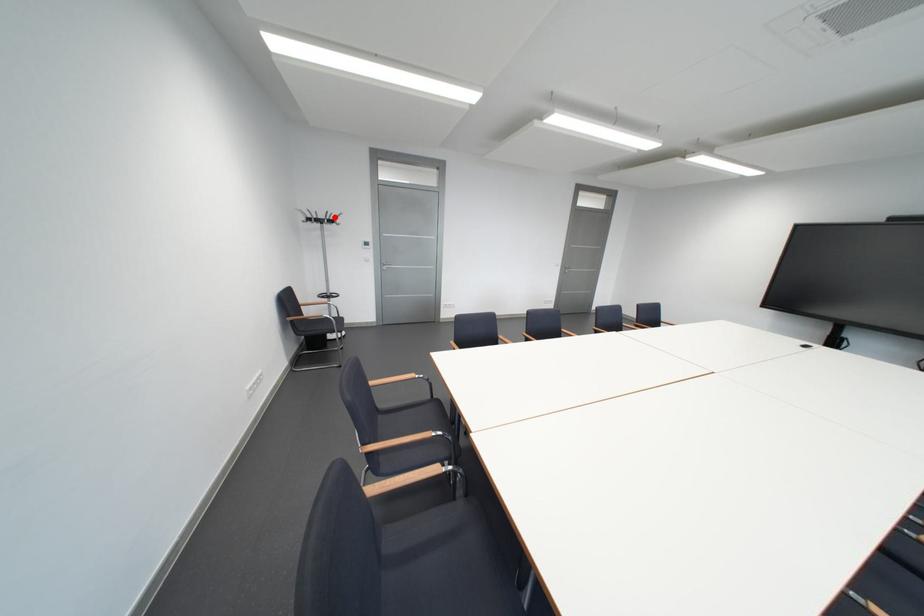
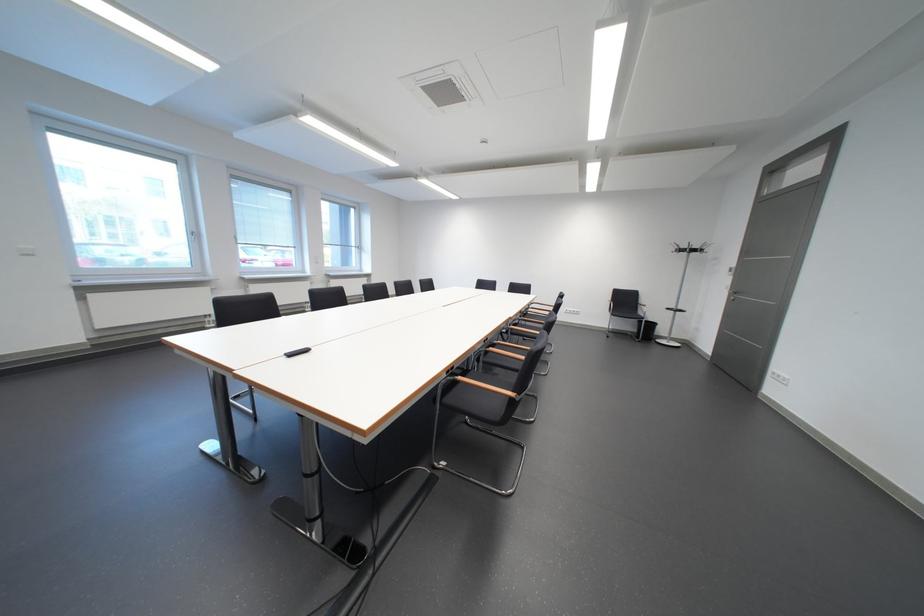
Question: I am providing you with two images of the same scene from different viewpoints. A red point is shown in image1. For the corresponding object point in image2, is it positioned nearer or farther from the camera?

Choices:
 (A) Nearer
 (B) Farther

Answer: (B)